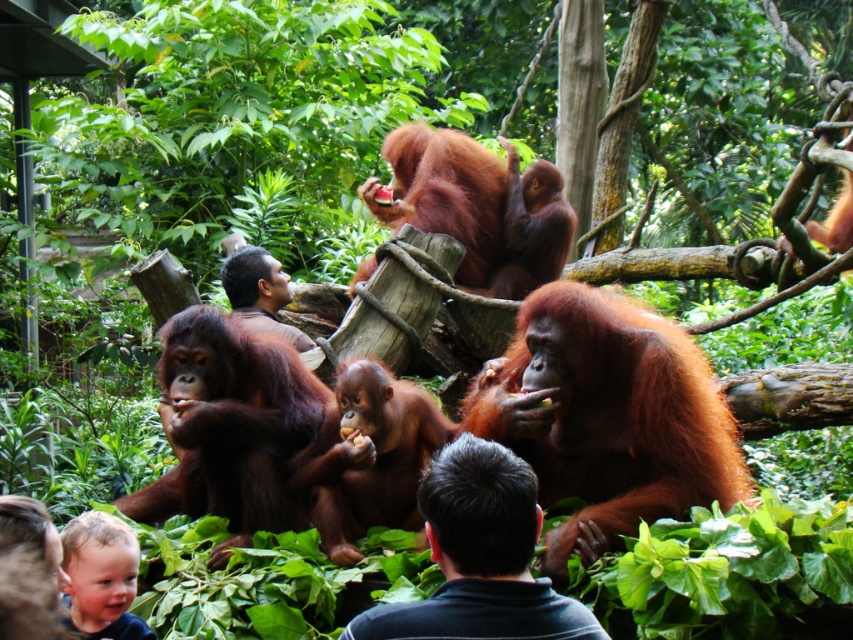
You are a zookeeper trying to identify the animals in the enclosure. You notice two distinct features in the scene. The shiny brown fur at center and the blonde hair at lower left. Which one is smaller in size?

The shiny brown fur at center is smaller in size compared to the blonde hair at lower left.

You are a photographer taking a picture of the orangutans in the zoo. You want to focus on the point at point [480,592] and point [125,524]. Which point should you adjust your focus to first to ensure it is in sharp focus?

Point [480,592] is closer to the camera than point [125,524], so you should adjust your focus to point [480,592] first to ensure it is in sharp focus.

You are a visitor at the zoo and want to take a photo of the shiny brown fur at center and the blonde hair at lower left. Which one will appear taller in the photo?

The blonde hair at lower left will appear taller in the photo because the shiny brown fur at center is shorter than the blonde hair at lower left.